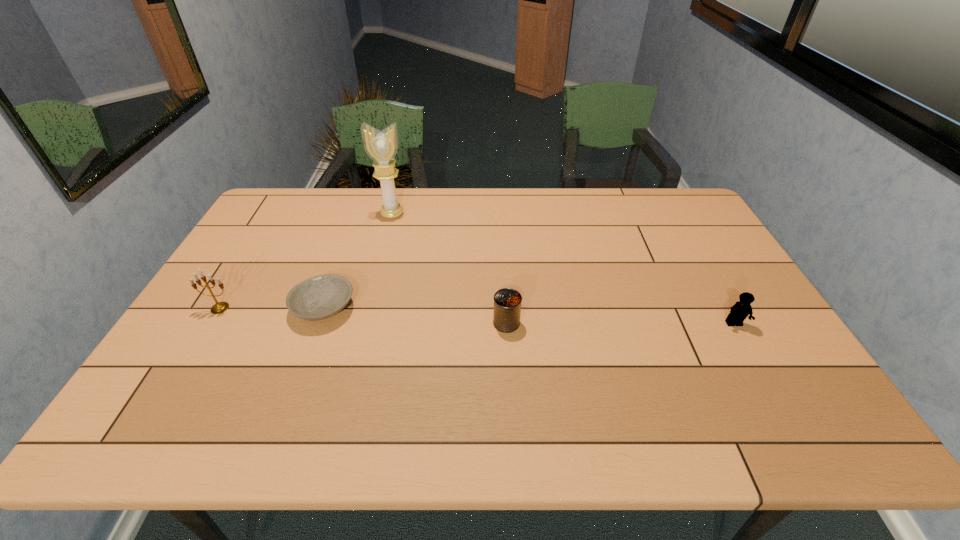
Identify the location of blank area located 0.090m on the front-facing side of the Lego. The width and height of the screenshot is (960, 540). (753, 357).

Where is `vacant space located on the back of the bowl`? The height and width of the screenshot is (540, 960). vacant space located on the back of the bowl is located at coordinates (356, 220).

Locate an element on the screen. Image resolution: width=960 pixels, height=540 pixels. object that is at the far edge is located at coordinates (381, 146).

You are a GUI agent. You are given a task and a screenshot of the screen. Output one action in this format:
    pyautogui.click(x=<x>, y=<y>)
    Task: Click on the object that is at the left edge
    This screenshot has width=960, height=540.
    Given the screenshot: What is the action you would take?
    pyautogui.click(x=218, y=308)

Locate an element on the screen. The height and width of the screenshot is (540, 960). object positioned at the right edge is located at coordinates (741, 309).

You are a GUI agent. You are given a task and a screenshot of the screen. Output one action in this format:
    pyautogui.click(x=<x>, y=<y>)
    Task: Click on the vacant space at the far edge
    The width and height of the screenshot is (960, 540).
    Given the screenshot: What is the action you would take?
    pyautogui.click(x=467, y=195)

Where is `vacant space at the near edge`? This screenshot has width=960, height=540. vacant space at the near edge is located at coordinates (698, 442).

Locate an element on the screen. vacant space at the left edge of the desktop is located at coordinates (252, 253).

You are a GUI agent. You are given a task and a screenshot of the screen. Output one action in this format:
    pyautogui.click(x=<x>, y=<y>)
    Task: Click on the vacant space at the right edge of the desktop
    This screenshot has height=540, width=960.
    Given the screenshot: What is the action you would take?
    pyautogui.click(x=675, y=226)

Where is `vacant point at the far left corner`? vacant point at the far left corner is located at coordinates (272, 210).